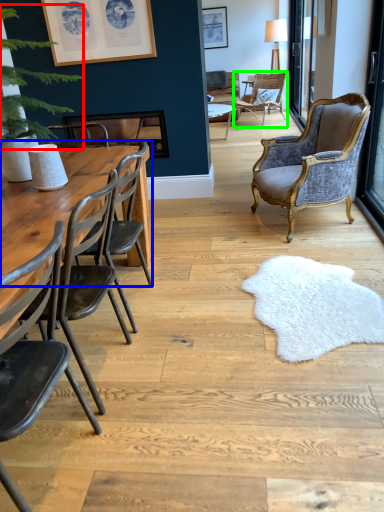
Question: Estimate the real-world distances between objects in this image. Which object is farther from plant (highlighted by a red box), table (highlighted by a blue box) or chair (highlighted by a green box)?

Choices:
 (A) table
 (B) chair

Answer: (B)